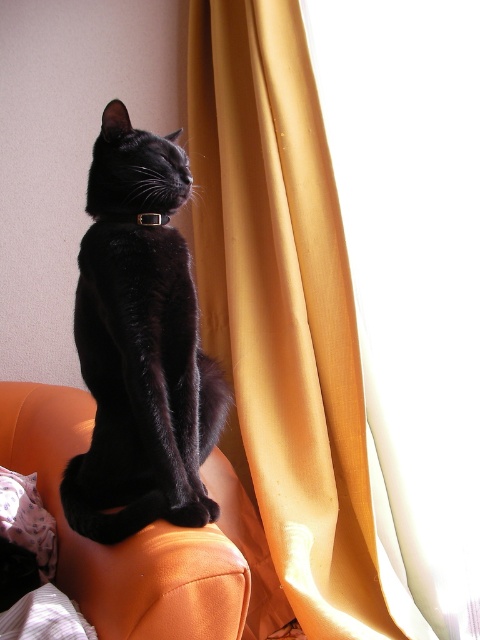
Can you confirm if golden velvet curtain at right is positioned to the left of matte black cat at center?

Incorrect, golden velvet curtain at right is not on the left side of matte black cat at center.

Does golden velvet curtain at right appear over matte black cat at center?

Correct, golden velvet curtain at right is located above matte black cat at center.

This screenshot has width=480, height=640. I want to click on golden velvet curtain at right, so click(x=287, y=317).

Can you confirm if golden velvet curtain at right is thinner than orange leather couch at upper center?

Yes.

Is golden velvet curtain at right bigger than orange leather couch at upper center?

Yes.

Which is in front, point (261, 182) or point (181, 557)?

Point (181, 557) is in front.

Where is `golden velvet curtain at right`? Image resolution: width=480 pixels, height=640 pixels. golden velvet curtain at right is located at coordinates (287, 317).

In the scene shown: Does matte black cat at center have a greater height compared to orange leather couch at upper center?

Yes, matte black cat at center is taller than orange leather couch at upper center.

Can you confirm if matte black cat at center is positioned below orange leather couch at upper center?

Incorrect, matte black cat at center is not positioned below orange leather couch at upper center.

Between point (160, 285) and point (8, 432), which one is positioned behind?

The point (8, 432) is behind.

The image size is (480, 640). In order to click on matte black cat at center in this screenshot , I will do `click(140, 344)`.